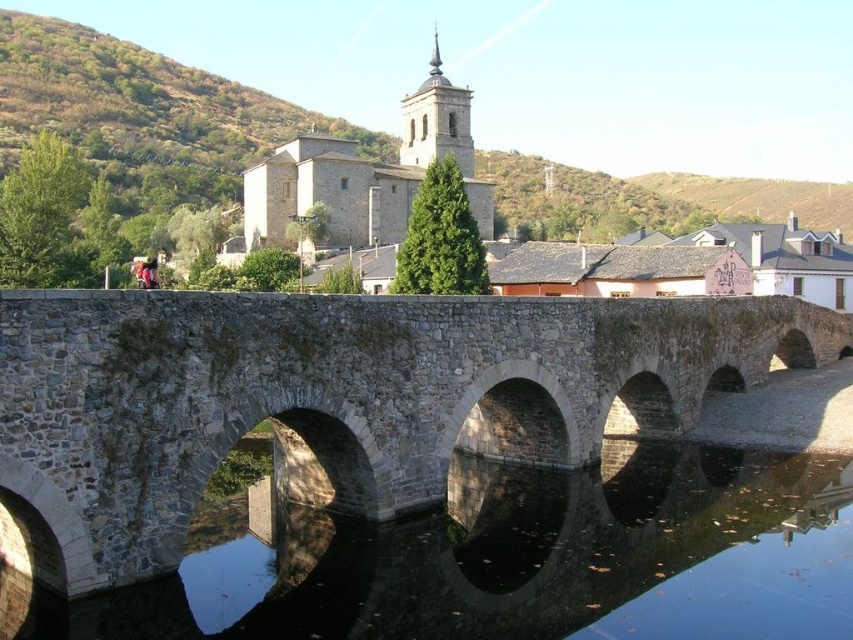
You are an architect designing a model of this scene. You need to ensure that the stone bridge at center and the black stone water at center are scaled correctly. Which object should be larger in your model?

The stone bridge at center should be larger than the black stone water at center in the model since the description states it is bigger.

You are standing on the stone bridge at center, looking towards the black stone water at center. Which object is closer to you?

The stone bridge at center is closer to you than the black stone water at center because it is in front of it.

You are standing at the point labeled as point (335, 400) in the image. Looking around, you see the stone bridge at center. Which direction should you face to look directly at the stone bridge at center?

Since the point (335, 400) corresponds to the stone bridge at center, you are already facing the stone bridge at center. Therefore, you should face forward to look directly at it.